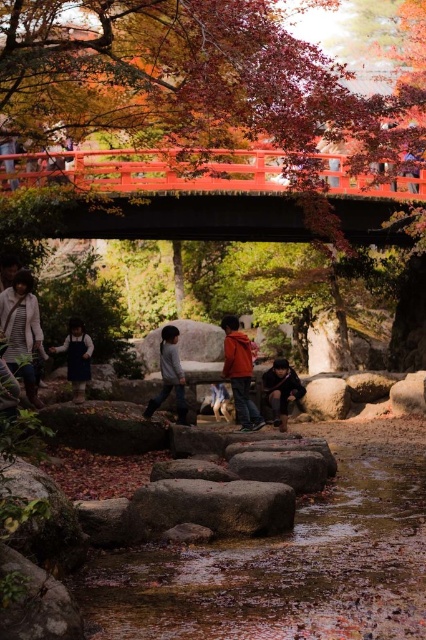
Question: In this image, where is red-orange hoodie at center located relative to dark brown leather jacket at center?

Choices:
 (A) above
 (B) below

Answer: (A)

Question: Which object is farther from the camera taking this photo?

Choices:
 (A) striped fabric jacket at left
 (B) red-orange hoodie at center
 (C) brown rough stone at center
 (D) smooth stone stream at center

Answer: (B)

Question: Can you confirm if smooth stone stream at center is thinner than brown rough stone at center?

Choices:
 (A) no
 (B) yes

Answer: (A)

Question: Among these objects, which one is farthest from the camera?

Choices:
 (A) striped fabric jacket at left
 (B) dark brown leather jacket at center

Answer: (B)

Question: Does smooth stone stream at center have a smaller size compared to red-orange hoodie at center?

Choices:
 (A) no
 (B) yes

Answer: (B)

Question: Based on their relative distances, which object is farther from the brown rough stone at center?

Choices:
 (A) smooth red bridge at upper center
 (B) smooth gray rock at center
 (C) red-orange hoodie at center
 (D) striped fabric jacket at left

Answer: (A)